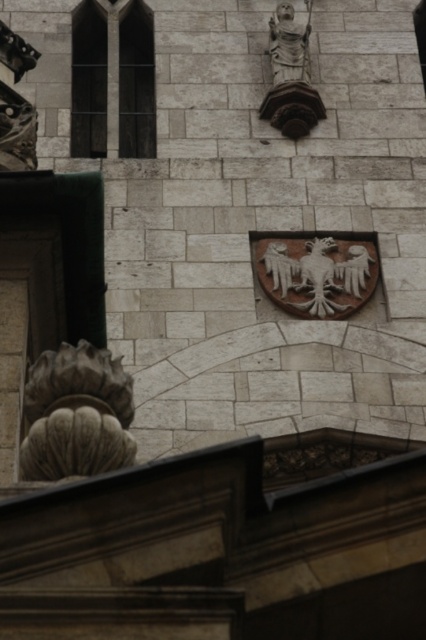
You are an architect examining the stone wall. You notice the carved stone ornament at left and the brown stone shield at center. Which object would cast a bigger shadow if the sun is directly overhead?

The carved stone ornament at left is larger in size than the brown stone shield at center, so it would cast a bigger shadow when the sun is directly overhead.

You are an architect analyzing the stone wall. You notice the carved stone ornament at left. Where is it located on the wall in terms of coordinates?

The carved stone ornament at left is located at coordinates point (77, 413) on the wall.

You are an architect examining the stone building. You notice the brown stone shield at center and the stone statue at upper center. Based on their positions, which one is situated higher up on the wall?

The stone statue at upper center is situated higher up on the wall than the brown stone shield at center.